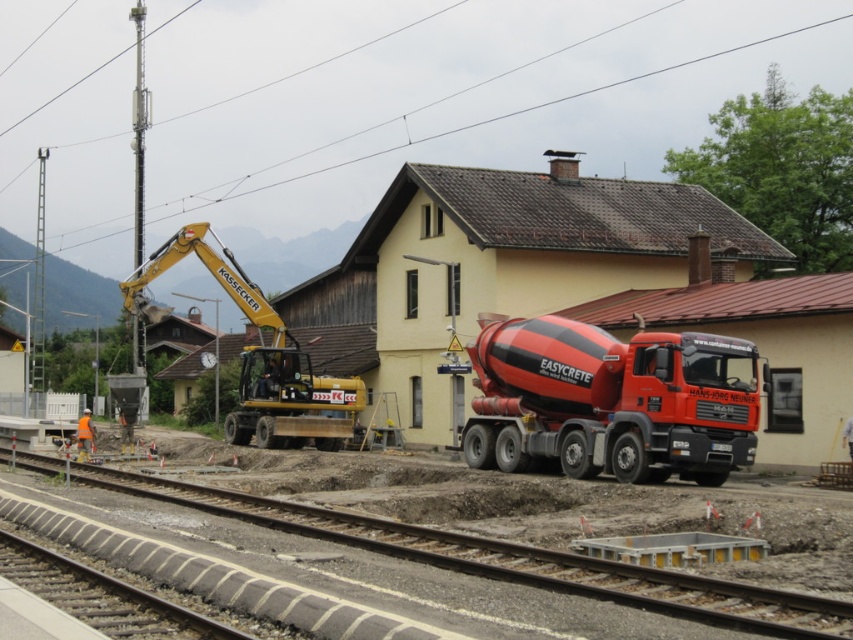
Does smooth asphalt track at center lie in front of yellow metallic excavator at left?

Yes, smooth asphalt track at center is in front of yellow metallic excavator at left.

Is point (793, 627) positioned behind point (299, 426)?

No, (793, 627) is closer to viewer.

Who is more forward, (815, 625) or (218, 253)?

Point (815, 625)

Locate an element on the screen. The image size is (853, 640). smooth asphalt track at center is located at coordinates click(x=509, y=561).

Does red matte concrete mixer at center have a greater width compared to yellow metallic excavator at left?

No.

Between red matte concrete mixer at center and yellow metallic excavator at left, which one is positioned higher?

yellow metallic excavator at left

This screenshot has height=640, width=853. Describe the element at coordinates (611, 401) in the screenshot. I see `red matte concrete mixer at center` at that location.

The width and height of the screenshot is (853, 640). Find the location of `red matte concrete mixer at center`. red matte concrete mixer at center is located at coordinates (611, 401).

Is red matte concrete mixer at center below smooth asphalt track at center?

No.

Does point (619, 420) lie in front of point (737, 604)?

That is False.

What do you see at coordinates (611, 401) in the screenshot? The height and width of the screenshot is (640, 853). I see `red matte concrete mixer at center` at bounding box center [611, 401].

Locate an element on the screen. red matte concrete mixer at center is located at coordinates (611, 401).